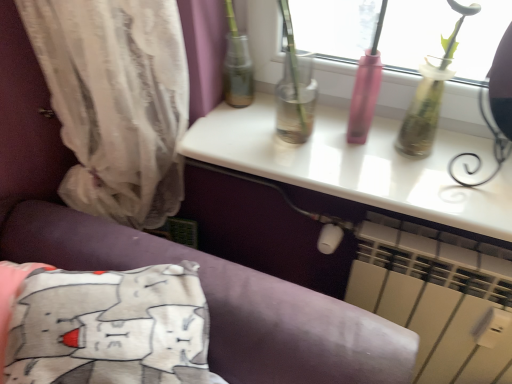
Question: Is white glossy table at upper center oriented towards white plastic radiator at lower right?

Choices:
 (A) no
 (B) yes

Answer: (A)

Question: Can you confirm if white glossy table at upper center is taller than white plastic radiator at lower right?

Choices:
 (A) yes
 (B) no

Answer: (B)

Question: Is white glossy table at upper center smaller than white plastic radiator at lower right?

Choices:
 (A) yes
 (B) no

Answer: (A)

Question: Is white glossy table at upper center further to camera compared to white plastic radiator at lower right?

Choices:
 (A) yes
 (B) no

Answer: (A)

Question: Is white glossy table at upper center outside white plastic radiator at lower right?

Choices:
 (A) no
 (B) yes

Answer: (B)

Question: From the image's perspective, is white glossy table at upper center beneath white plastic radiator at lower right?

Choices:
 (A) yes
 (B) no

Answer: (B)

Question: Is white plastic radiator at lower right aimed at white glossy table at upper center?

Choices:
 (A) yes
 (B) no

Answer: (B)

Question: From the image's perspective, is white plastic radiator at lower right below white glossy table at upper center?

Choices:
 (A) yes
 (B) no

Answer: (A)

Question: Is white plastic radiator at lower right with white glossy table at upper center?

Choices:
 (A) yes
 (B) no

Answer: (B)

Question: Can you confirm if white plastic radiator at lower right is positioned to the left of white glossy table at upper center?

Choices:
 (A) no
 (B) yes

Answer: (A)

Question: Can you confirm if white plastic radiator at lower right is shorter than white glossy table at upper center?

Choices:
 (A) no
 (B) yes

Answer: (A)

Question: Does white plastic radiator at lower right have a greater height compared to white glossy table at upper center?

Choices:
 (A) yes
 (B) no

Answer: (A)

Question: Does white cotton pillow at lower left have a greater height compared to white glossy table at upper center?

Choices:
 (A) no
 (B) yes

Answer: (B)